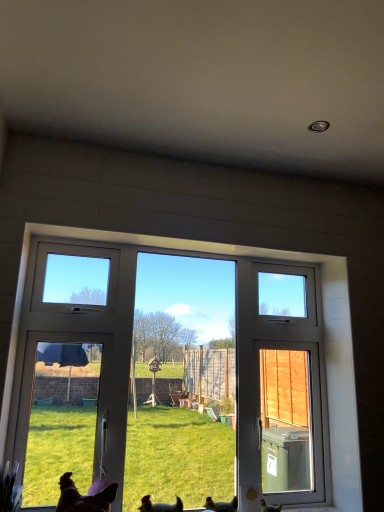
Question: Considering the relative positions of brown fur dog at lower left, which is counted as the first dog, starting from the left, and white plastic window at center in the image provided, is brown fur dog at lower left, which is counted as the first dog, starting from the left, in front of white plastic window at center?

Choices:
 (A) yes
 (B) no

Answer: (A)

Question: From the image's perspective, is brown fur dog at lower left, which is counted as the first dog, starting from the left, under white plastic window at center?

Choices:
 (A) yes
 (B) no

Answer: (A)

Question: Is the depth of brown fur dog at lower left, which is counted as the first dog, starting from the left, greater than that of white plastic window at center?

Choices:
 (A) yes
 (B) no

Answer: (B)

Question: Does brown fur dog at lower left, which is counted as the first dog, starting from the left, have a greater width compared to white plastic window at center?

Choices:
 (A) no
 (B) yes

Answer: (B)

Question: Does brown fur dog at lower left, which is counted as the first dog, starting from the left, have a greater height compared to white plastic window at center?

Choices:
 (A) no
 (B) yes

Answer: (A)

Question: Is brown matte chicken at lower right, the second chicken in the left-to-right sequence, inside or outside of brown fur dog at lower center, the 1th dog positioned from the right?

Choices:
 (A) inside
 (B) outside

Answer: (B)

Question: Looking at their shapes, would you say brown matte chicken at lower right, the second chicken in the left-to-right sequence, is wider or thinner than brown fur dog at lower center, which is the second dog from left to right?

Choices:
 (A) thin
 (B) wide

Answer: (A)

Question: Based on their positions, is brown matte chicken at lower right, the second chicken in the left-to-right sequence, located to the left or right of brown fur dog at lower center, the 1th dog positioned from the right?

Choices:
 (A) left
 (B) right

Answer: (B)

Question: From a real-world perspective, is brown matte chicken at lower right, the 1th chicken when ordered from right to left, above or below brown fur dog at lower center, which is the second dog from left to right?

Choices:
 (A) below
 (B) above

Answer: (A)

Question: From their relative heights in the image, would you say white plastic window at center is taller or shorter than brown feathered chicken at lower center, the 2th chicken from the right?

Choices:
 (A) tall
 (B) short

Answer: (A)

Question: Is point (185, 241) positioned closer to the camera than point (208, 499)?

Choices:
 (A) closer
 (B) farther

Answer: (A)

Question: Based on their sizes in the image, would you say white plastic window at center is bigger or smaller than brown feathered chicken at lower center, the 2th chicken from the right?

Choices:
 (A) big
 (B) small

Answer: (A)

Question: Based on their positions, is white plastic window at center located to the left or right of brown feathered chicken at lower center, the 2th chicken from the right?

Choices:
 (A) right
 (B) left

Answer: (B)

Question: Relative to brown fur dog at lower left, which is counted as the first dog, starting from the left, is brown matte chicken at lower right, the 1th chicken when ordered from right to left, in front or behind?

Choices:
 (A) behind
 (B) front

Answer: (A)

Question: From a real-world perspective, is brown matte chicken at lower right, the second chicken in the left-to-right sequence, physically located above or below brown fur dog at lower left, which is counted as the first dog, starting from the left?

Choices:
 (A) below
 (B) above

Answer: (A)